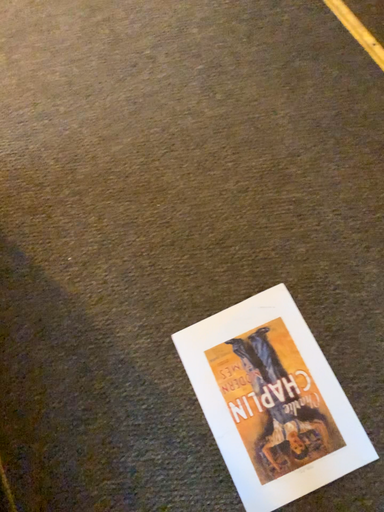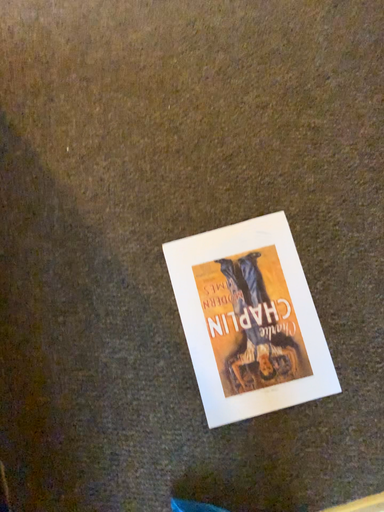
Question: How did the camera likely rotate when shooting the video?

Choices:
 (A) rotated upward
 (B) rotated downward

Answer: (B)